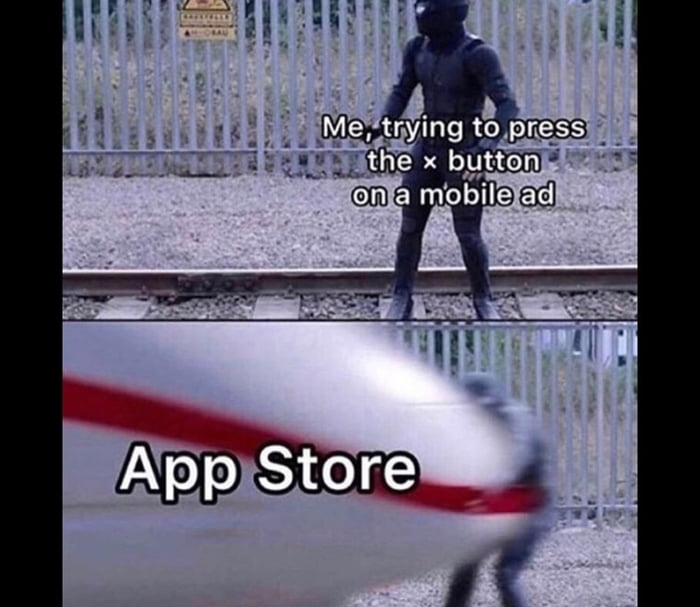
The width and height of the screenshot is (700, 607). I want to click on frames, so click(335, 202), click(354, 427).